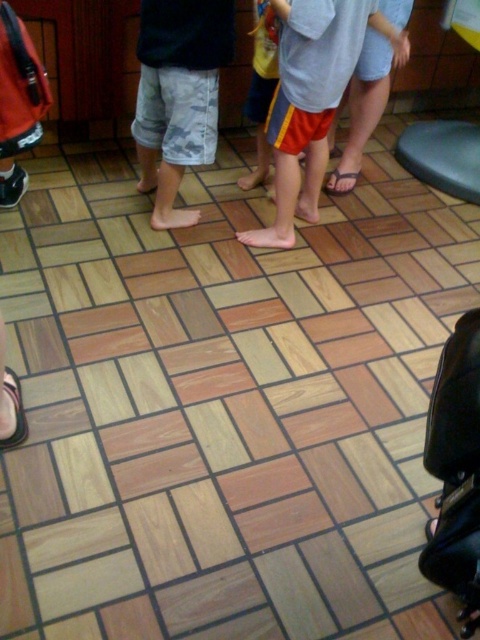
Does camouflage shorts at center appear over black plastic stool at lower right?

No, camouflage shorts at center is not above black plastic stool at lower right.

Who is more distant from viewer, (x=165, y=115) or (x=410, y=163)?

Point (x=410, y=163)

Locate an element on the screen. The image size is (480, 640). camouflage shorts at center is located at coordinates (179, 93).

Does black plastic stool at lower right have a larger size compared to brown leather sandal at center?

Yes.

Who is taller, black plastic stool at lower right or brown leather sandal at center?

Standing taller between the two is black plastic stool at lower right.

Describe the element at coordinates (443, 156) in the screenshot. I see `black plastic stool at lower right` at that location.

Locate an element on the screen. The width and height of the screenshot is (480, 640). black plastic stool at lower right is located at coordinates (443, 156).

Can you confirm if camouflage shorts at center is positioned below light blue denim shorts at center?

Correct, camouflage shorts at center is located below light blue denim shorts at center.

Is the position of camouflage shorts at center more distant than that of light blue denim shorts at center?

That is False.

This screenshot has height=640, width=480. In order to click on camouflage shorts at center in this screenshot , I will do `click(179, 93)`.